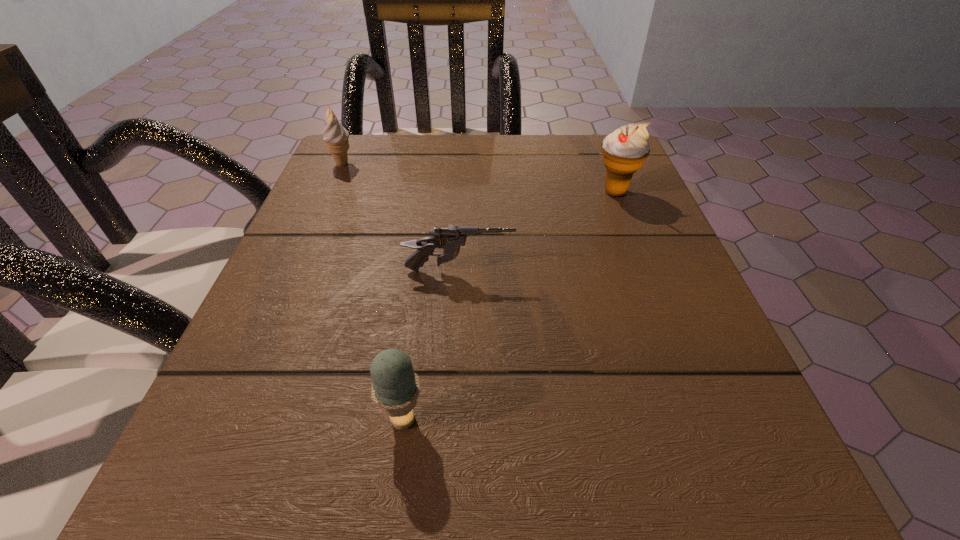
This screenshot has height=540, width=960. I want to click on vacant region located 0.190m on the back of the nearest object, so click(420, 290).

Locate an element on the screen. This screenshot has width=960, height=540. blank space located 0.240m at the barrel of the shortest object is located at coordinates (661, 271).

Identify the location of object located in the left edge section of the desktop. (335, 136).

At what (x,y) coordinates should I click in order to perform the action: click on object present at the right edge. Please return your answer as a coordinate pair (x, y). Image resolution: width=960 pixels, height=540 pixels. Looking at the image, I should click on (624, 151).

This screenshot has height=540, width=960. What are the coordinates of `object that is at the far left corner` in the screenshot? It's located at (335, 136).

You are a GUI agent. You are given a task and a screenshot of the screen. Output one action in this format:
    pyautogui.click(x=<x>, y=<y>)
    Task: Click on the object situated at the far right corner
    
    Given the screenshot: What is the action you would take?
    pyautogui.click(x=624, y=151)

You are a GUI agent. You are given a task and a screenshot of the screen. Output one action in this format:
    pyautogui.click(x=<x>, y=<y>)
    Task: Click on the free space at the far edge
    This screenshot has width=960, height=540.
    Given the screenshot: What is the action you would take?
    pyautogui.click(x=499, y=160)

This screenshot has width=960, height=540. I want to click on vacant space at the near edge of the desktop, so click(444, 514).

In the image, there is a desktop. Identify the location of vacant space at the left edge. (348, 286).

Identify the location of free space at the right edge of the desktop. The width and height of the screenshot is (960, 540). (644, 220).